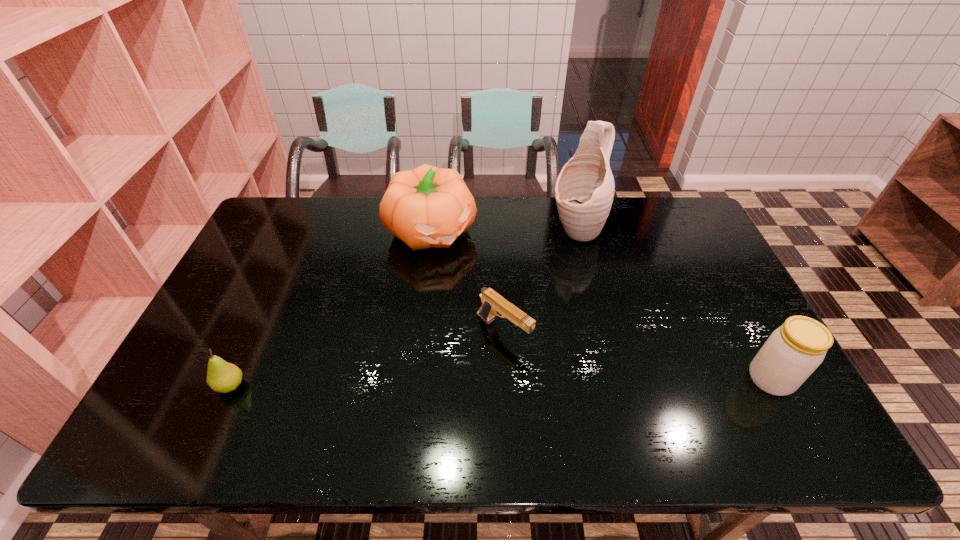
This screenshot has height=540, width=960. Identify the location of the leftmost object. (222, 376).

This screenshot has height=540, width=960. Identify the location of jar. (793, 351).

Image resolution: width=960 pixels, height=540 pixels. What are the coordinates of `the third shortest object` in the screenshot? It's located at (793, 351).

Identify the location of the fourth object from right to left. (425, 207).

What are the coordinates of `the fourth shortest object` in the screenshot? It's located at (425, 207).

You are a GUI agent. You are given a task and a screenshot of the screen. Output one action in this format:
    pyautogui.click(x=<x>, y=<y>)
    Task: Click on the third object from left to right
    
    Given the screenshot: What is the action you would take?
    pyautogui.click(x=493, y=304)

This screenshot has height=540, width=960. I want to click on the shortest object, so click(493, 304).

Where is `the tallest object`? the tallest object is located at coordinates coord(584,190).

This screenshot has height=540, width=960. In order to click on pitcher in this screenshot , I will do `click(584, 190)`.

Image resolution: width=960 pixels, height=540 pixels. What are the coordinates of `vacant space located on the back of the leftmost object` in the screenshot? It's located at (285, 264).